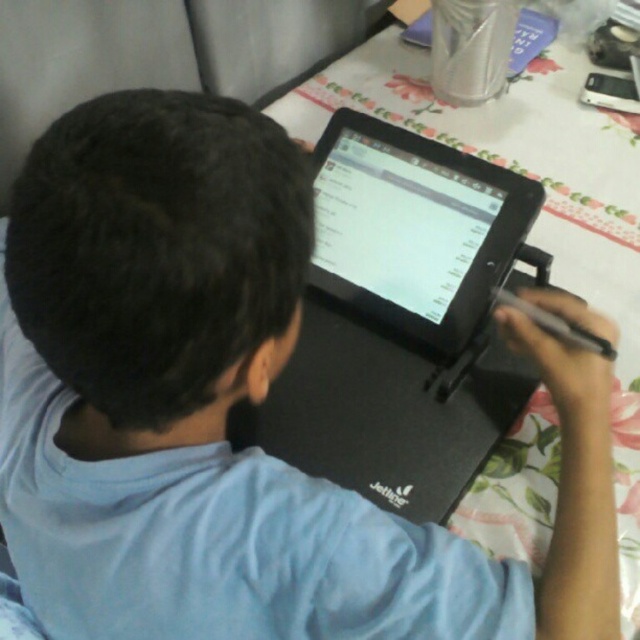
Between point (353, 168) and point (356, 205), which one is positioned in front?

Point (356, 205)

Is black matte laptop at center wider than black glossy tablet at center?

Indeed, black matte laptop at center has a greater width compared to black glossy tablet at center.

The width and height of the screenshot is (640, 640). What do you see at coordinates (401, 321) in the screenshot? I see `black matte laptop at center` at bounding box center [401, 321].

At what (x,y) coordinates should I click in order to perform the action: click on black matte laptop at center. Please return your answer as a coordinate pair (x, y). Looking at the image, I should click on (401, 321).